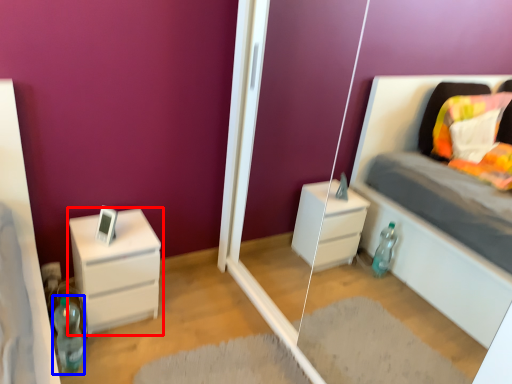
Question: Which object is further to the camera taking this photo, chest of drawers (highlighted by a red box) or bottle (highlighted by a blue box)?

Choices:
 (A) chest of drawers
 (B) bottle

Answer: (A)